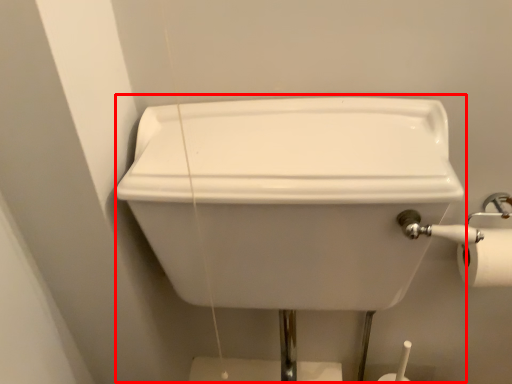
Question: In this image, where is sink (annotated by the red box) located relative to toilet paper?

Choices:
 (A) right
 (B) left

Answer: (B)